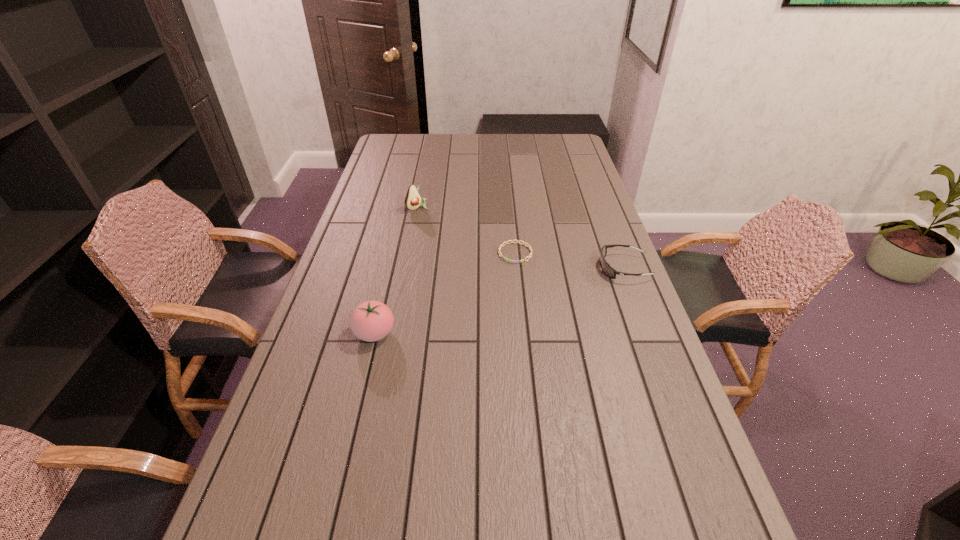
The image size is (960, 540). Find the location of `free spot between the goggles and the farthest object`. free spot between the goggles and the farthest object is located at coordinates (520, 238).

The width and height of the screenshot is (960, 540). Find the location of `free spot between the goggles and the nearest object`. free spot between the goggles and the nearest object is located at coordinates (499, 301).

Identify which object is the second closest to the nearest object. Please provide its 2D coordinates. Your answer should be formatted as a tuple, i.e. [(x, y)], where the tuple contains the x and y coordinates of a point satisfying the conditions above.

[(413, 200)]

Point out which object is positioned as the nearest to the second shortest object. Please provide its 2D coordinates. Your answer should be formatted as a tuple, i.e. [(x, y)], where the tuple contains the x and y coordinates of a point satisfying the conditions above.

[(513, 261)]

Identify the location of blank area in the image that satisfies the following two spatial constraints: 1. on the back side of the goggles; 2. on the lenses of the tomato. This screenshot has height=540, width=960. (390, 268).

The width and height of the screenshot is (960, 540). What are the coordinates of `vacant area that satisfies the following two spatial constraints: 1. on the front side of the avocado; 2. on the lenses of the goggles` in the screenshot? It's located at pyautogui.click(x=405, y=268).

Find the location of `free space that satisfies the following two spatial constraints: 1. on the front side of the farthest object; 2. on the lenses of the rightmost object`. free space that satisfies the following two spatial constraints: 1. on the front side of the farthest object; 2. on the lenses of the rightmost object is located at coordinates (405, 268).

This screenshot has width=960, height=540. In order to click on vacant space that satisfies the following two spatial constraints: 1. on the front side of the avocado; 2. on the right side of the second object from right to left in this screenshot , I will do `click(408, 253)`.